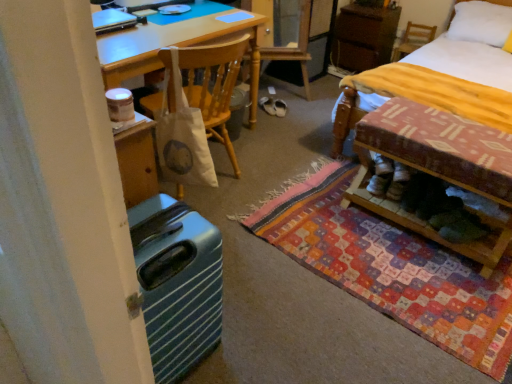
Question: From a real-world perspective, is white fabric shoe at center, marked as the first footwear in a left-to-right arrangement, on brown wood cabinet at upper right?

Choices:
 (A) no
 (B) yes

Answer: (A)

Question: From a real-world perspective, is white fabric shoe at center, marked as the first footwear in a left-to-right arrangement, positioned under brown wood cabinet at upper right based on gravity?

Choices:
 (A) no
 (B) yes

Answer: (B)

Question: Is there a large distance between white fabric shoe at center, marked as the first footwear in a left-to-right arrangement, and brown wood cabinet at upper right?

Choices:
 (A) no
 (B) yes

Answer: (B)

Question: Can you confirm if white fabric shoe at center, marked as the 2th footwear in a right-to-left arrangement, is taller than brown wood cabinet at upper right?

Choices:
 (A) yes
 (B) no

Answer: (B)

Question: Is white fabric shoe at center, marked as the 2th footwear in a right-to-left arrangement, positioned beyond the bounds of brown wood cabinet at upper right?

Choices:
 (A) no
 (B) yes

Answer: (B)

Question: Does white fabric shoe at center, marked as the first footwear in a left-to-right arrangement, come behind brown wood cabinet at upper right?

Choices:
 (A) yes
 (B) no

Answer: (B)

Question: Considering the relative sizes of brown wood cabinet at upper right and wooden chair at upper right, positioned as the 2th chair in bottom-to-top order, in the image provided, is brown wood cabinet at upper right taller than wooden chair at upper right, positioned as the 2th chair in bottom-to-top order,?

Choices:
 (A) no
 (B) yes

Answer: (B)

Question: Can you confirm if brown wood cabinet at upper right is smaller than wooden chair at upper right, the 1th chair viewed from the right?

Choices:
 (A) yes
 (B) no

Answer: (B)

Question: Is brown wood cabinet at upper right beside wooden chair at upper right, placed as the first chair when sorted from back to front?

Choices:
 (A) yes
 (B) no

Answer: (B)

Question: Does brown wood cabinet at upper right come behind wooden chair at upper right, placed as the first chair when sorted from back to front?

Choices:
 (A) yes
 (B) no

Answer: (B)

Question: Can you confirm if brown wood cabinet at upper right is positioned to the right of wooden chair at upper right, placed as the first chair when sorted from back to front?

Choices:
 (A) no
 (B) yes

Answer: (A)

Question: Is brown wood cabinet at upper right far away from wooden chair at upper right, positioned as the second chair in front-to-back order?

Choices:
 (A) yes
 (B) no

Answer: (B)

Question: Is brown wood cabinet at upper right wider than wooden bed frame at lower right?

Choices:
 (A) yes
 (B) no

Answer: (A)